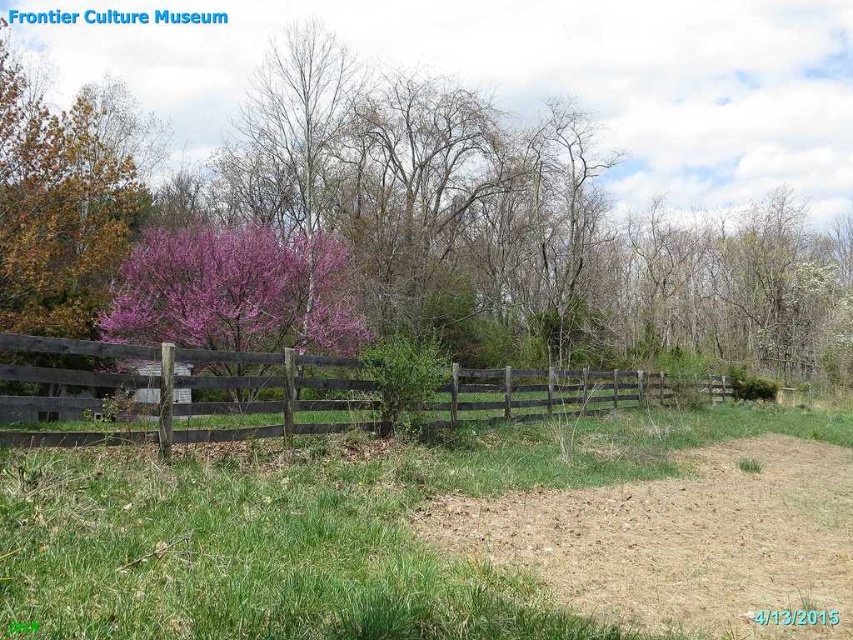
Who is positioned more to the left, brown wooden fence at left or purple bloom tree at center?

purple bloom tree at center

Is brown wooden fence at left above purple bloom tree at center?

Incorrect, brown wooden fence at left is not positioned above purple bloom tree at center.

At what (x,y) coordinates should I click in order to perform the action: click on brown wooden fence at left. Please return your answer as a coordinate pair (x, y). The image size is (853, 640). Looking at the image, I should click on (199, 388).

Image resolution: width=853 pixels, height=640 pixels. In order to click on brown wooden fence at left in this screenshot , I will do `click(199, 388)`.

Which is above, purple bloom at center or purple bloom tree at center?

purple bloom at center

Is purple bloom at center wider than purple bloom tree at center?

Yes, purple bloom at center is wider than purple bloom tree at center.

Does point (576, 301) lie in front of point (338, 349)?

No.

In order to click on purple bloom at center in this screenshot , I will do `click(514, 225)`.

Which of these two, purple bloom at center or brown wooden fence at left, stands taller?

Standing taller between the two is purple bloom at center.

Does purple bloom at center have a lesser height compared to brown wooden fence at left?

In fact, purple bloom at center may be taller than brown wooden fence at left.

Locate an element on the screen. purple bloom at center is located at coordinates (x=514, y=225).